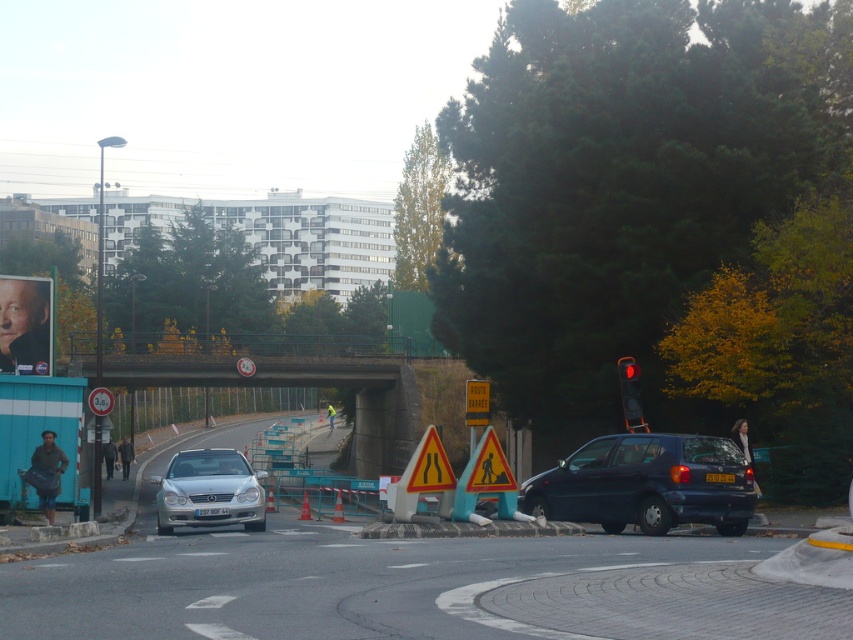
Is concrete bridge at center positioned before red glass traffic light at upper right?

No, it is behind red glass traffic light at upper right.

Can you confirm if concrete bridge at center is thinner than red glass traffic light at upper right?

Incorrect, concrete bridge at center's width is not less than red glass traffic light at upper right's.

Locate an element on the screen. The image size is (853, 640). concrete bridge at center is located at coordinates (239, 372).

Who is lower down, dark blue matte hatchback at right or yellow reflective triangle at center?

dark blue matte hatchback at right

Is point (636, 470) farther from viewer compared to point (88, 397)?

No, it is in front of (88, 397).

At what (x,y) coordinates should I click in order to perform the action: click on dark blue matte hatchback at right. Please return your answer as a coordinate pair (x, y). This screenshot has height=640, width=853. Looking at the image, I should click on (646, 484).

Which of these two, concrete bridge at center or yellow plastic road sign at center, stands taller?

yellow plastic road sign at center

Based on the photo, can you confirm if concrete bridge at center is thinner than yellow plastic road sign at center?

No.

Which is behind, point (279, 385) or point (474, 403)?

Point (279, 385)

At what (x,y) coordinates should I click in order to perform the action: click on concrete bridge at center. Please return your answer as a coordinate pair (x, y). Image resolution: width=853 pixels, height=640 pixels. Looking at the image, I should click on (239, 372).